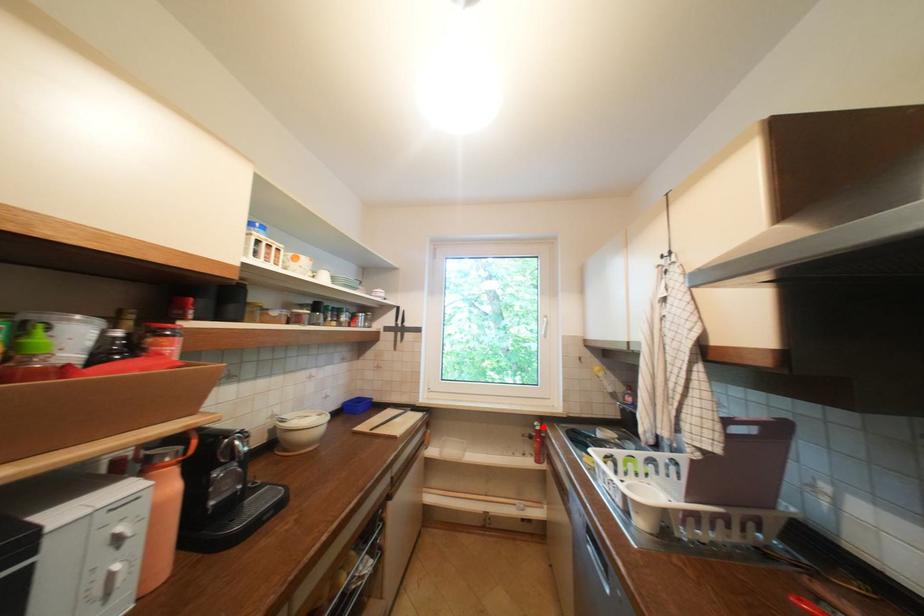
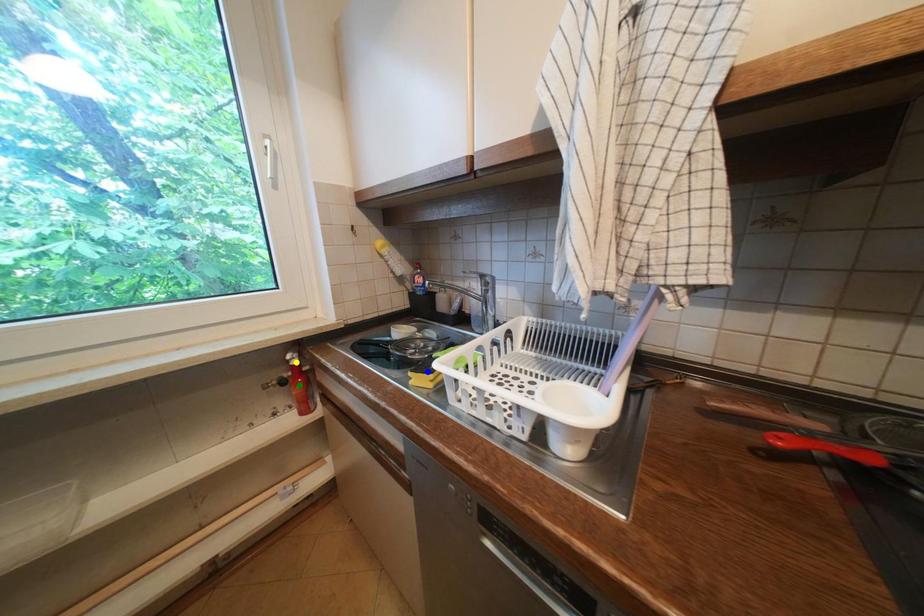
Question: I am providing you with two images of the same scene from different viewpoints. A red point is marked on the first image. You are given multiple points on the second image. Which mark in image 2 goes with the point in image 1?

Choices:
 (A) blue point
 (B) green point
 (C) yellow point

Answer: (C)